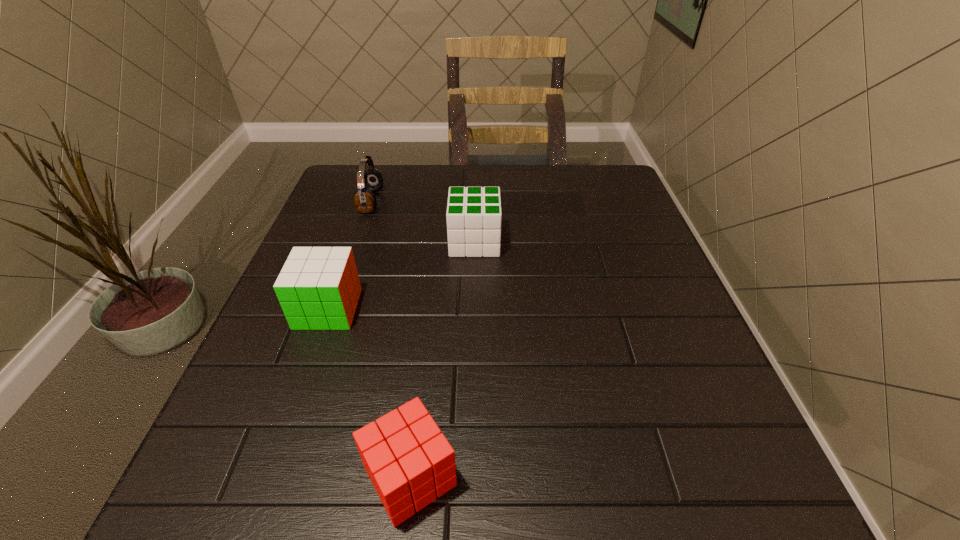
I want to click on vacant space at the far right corner of the desktop, so click(617, 205).

You are a GUI agent. You are given a task and a screenshot of the screen. Output one action in this format:
    pyautogui.click(x=<x>, y=<y>)
    Task: Click on the blank space at the near right corner
    The height and width of the screenshot is (540, 960).
    Given the screenshot: What is the action you would take?
    pyautogui.click(x=655, y=480)

Locate an element on the screen. This screenshot has height=540, width=960. free spot between the farthest cube and the leftmost cube is located at coordinates (401, 275).

Where is `vacant space that is in between the second nearest object and the nearest object`? vacant space that is in between the second nearest object and the nearest object is located at coordinates (369, 393).

Locate an element on the screen. This screenshot has height=540, width=960. free spot between the farthest object and the shortest object is located at coordinates (391, 339).

At what (x,y) coordinates should I click in order to perform the action: click on free spot between the nearest cube and the headset. Please return your answer as a coordinate pair (x, y). The width and height of the screenshot is (960, 540). Looking at the image, I should click on (391, 339).

Image resolution: width=960 pixels, height=540 pixels. In order to click on free area in between the nearest object and the farthest object in this screenshot , I will do `click(391, 339)`.

Find the location of a particular element. The image size is (960, 540). vacant area between the shortest object and the farthest cube is located at coordinates (443, 359).

This screenshot has height=540, width=960. Find the location of `vacant area between the headset and the shortest cube`. vacant area between the headset and the shortest cube is located at coordinates (391, 339).

You are a GUI agent. You are given a task and a screenshot of the screen. Output one action in this format:
    pyautogui.click(x=<x>, y=<y>)
    Task: Click on the free space that is in between the farthest cube and the nearest cube
    This screenshot has width=960, height=540.
    Given the screenshot: What is the action you would take?
    pyautogui.click(x=443, y=359)